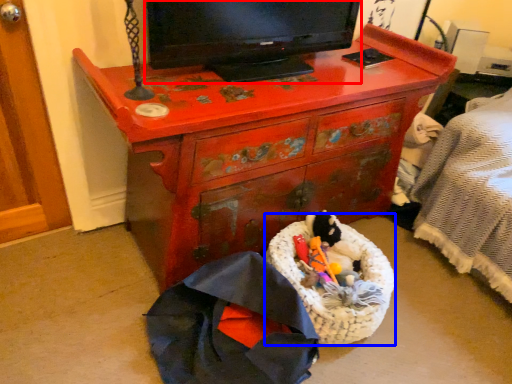
Question: Which object appears closest to the camera in this image, television (highlighted by a red box) or laundry basket (highlighted by a blue box)?

Choices:
 (A) television
 (B) laundry basket

Answer: (A)